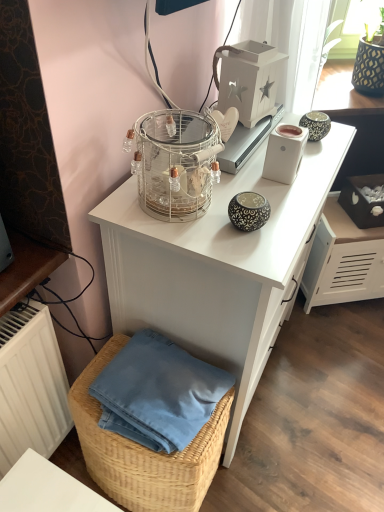
Question: Is white wooden lantern at upper center, which is the 2th appliance from bottom to top, taller than woven straw basket at lower left?

Choices:
 (A) no
 (B) yes

Answer: (A)

Question: Can you confirm if white wooden lantern at upper center, which is the 2th appliance from bottom to top, is bigger than woven straw basket at lower left?

Choices:
 (A) no
 (B) yes

Answer: (A)

Question: Is white wooden lantern at upper center, acting as the first appliance starting from the top, not near woven straw basket at lower left?

Choices:
 (A) no
 (B) yes

Answer: (A)

Question: Does white wooden lantern at upper center, acting as the first appliance starting from the top, have a greater width compared to woven straw basket at lower left?

Choices:
 (A) no
 (B) yes

Answer: (A)

Question: Is white wooden lantern at upper center, acting as the first appliance starting from the top, positioned with its back to woven straw basket at lower left?

Choices:
 (A) yes
 (B) no

Answer: (B)

Question: Considering the relative sizes of white wooden lantern at upper center, acting as the first appliance starting from the top, and woven straw basket at lower left in the image provided, is white wooden lantern at upper center, acting as the first appliance starting from the top, shorter than woven straw basket at lower left?

Choices:
 (A) no
 (B) yes

Answer: (B)

Question: Does clear glass birdcage at upper center have a lesser width compared to white glossy desk at upper center?

Choices:
 (A) no
 (B) yes

Answer: (B)

Question: Is clear glass birdcage at upper center further to camera compared to white glossy desk at upper center?

Choices:
 (A) no
 (B) yes

Answer: (A)

Question: From a real-world perspective, is clear glass birdcage at upper center positioned under white glossy desk at upper center based on gravity?

Choices:
 (A) no
 (B) yes

Answer: (A)

Question: Considering the relative positions of clear glass birdcage at upper center and white glossy desk at upper center in the image provided, is clear glass birdcage at upper center to the right of white glossy desk at upper center from the viewer's perspective?

Choices:
 (A) no
 (B) yes

Answer: (A)

Question: Considering the relative sizes of clear glass birdcage at upper center and white glossy desk at upper center in the image provided, is clear glass birdcage at upper center shorter than white glossy desk at upper center?

Choices:
 (A) no
 (B) yes

Answer: (B)

Question: Does clear glass birdcage at upper center have a larger size compared to white glossy desk at upper center?

Choices:
 (A) yes
 (B) no

Answer: (B)

Question: Can you confirm if woven straw basket at lower left is positioned to the left of white glossy desk at upper center?

Choices:
 (A) yes
 (B) no

Answer: (A)